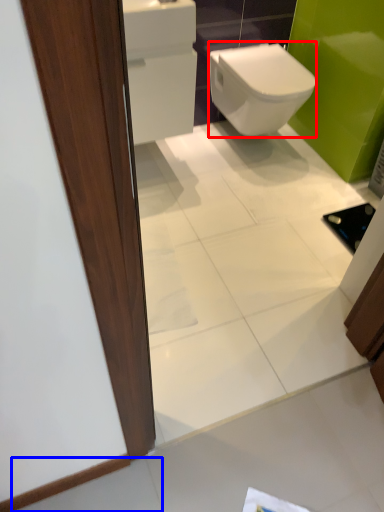
Question: Which object appears farthest to the camera in this image, bidet (highlighted by a red box) or tile (highlighted by a blue box)?

Choices:
 (A) bidet
 (B) tile

Answer: (A)